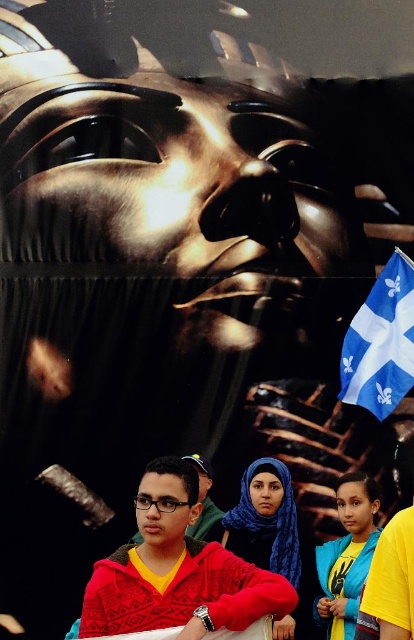
You are an observer looking at the image. There are two blue fabric items in the scene. The first is the blue fabric hijab at center and the second is the blue fabric flag at lower right. Which of these blue fabric items is positioned lower in the image?

The blue fabric hijab at center is positioned below the blue fabric flag at lower right, so the blue fabric hijab at center is lower in the image.